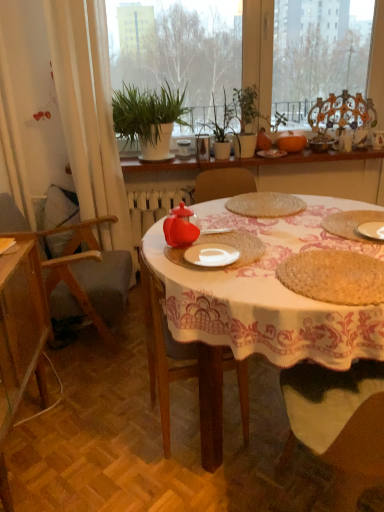
What are the coordinates of `vacant area located to the right-hand side of matte glass teapot at center` in the screenshot? It's located at (239, 241).